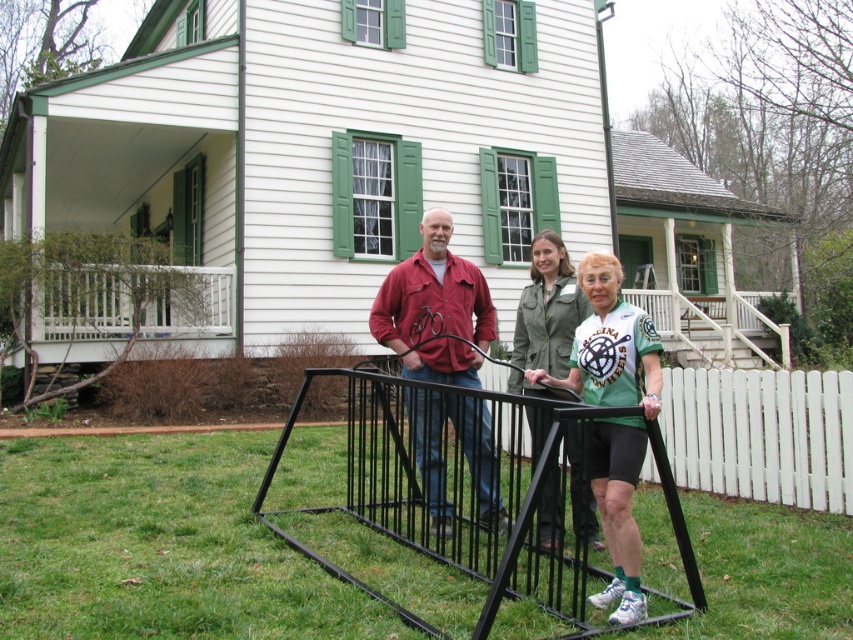
Is matte black bicycle at center closer to camera compared to matte red shirt at center?

No, matte black bicycle at center is further to the viewer.

Which is in front, point (412, 378) or point (384, 282)?

Point (412, 378) is in front.

This screenshot has width=853, height=640. I want to click on matte black bicycle at center, so click(x=434, y=308).

Is matte red shirt at center bigger than green fabric shirt at center?

Correct, matte red shirt at center is larger in size than green fabric shirt at center.

Where is `matte red shirt at center`? This screenshot has height=640, width=853. matte red shirt at center is located at coordinates (434, 308).

Can you confirm if black metal cage at center is positioned to the left of green fabric shirt at center?

Indeed, black metal cage at center is positioned on the left side of green fabric shirt at center.

Is point (408, 611) more distant than point (614, 260)?

No, (408, 611) is in front of (614, 260).

The image size is (853, 640). I want to click on black metal cage at center, so click(x=456, y=490).